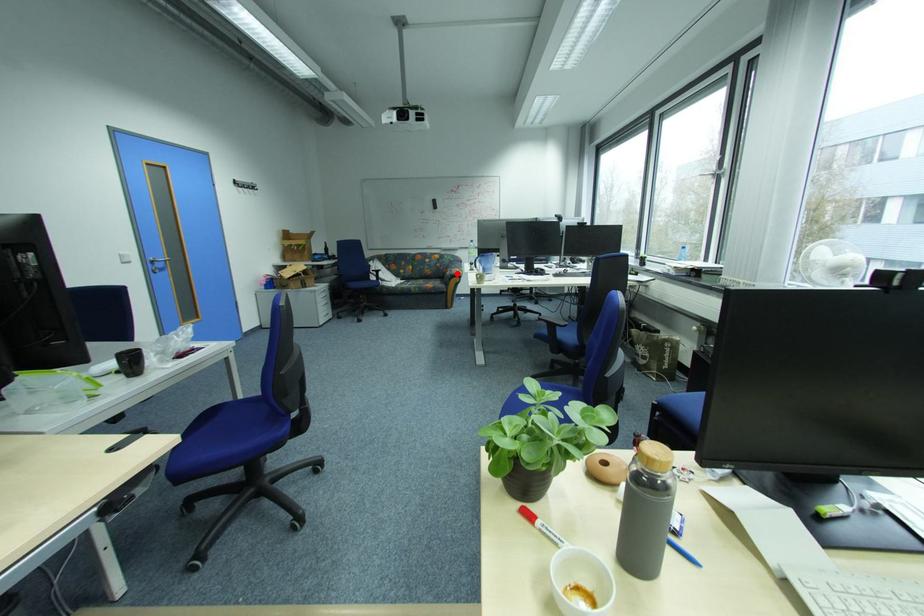
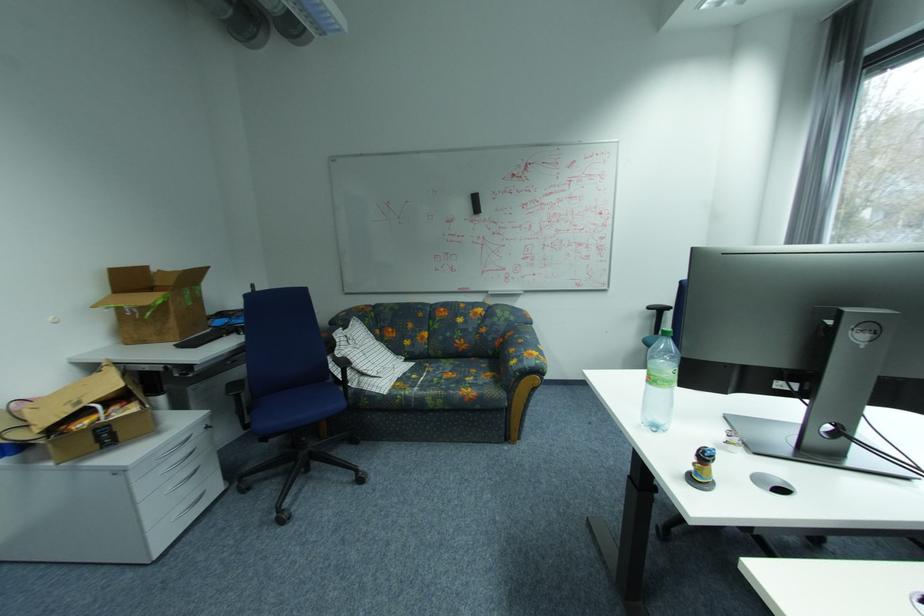
In the second image, find the point that corresponds to the highlighted location in the first image.

(521, 363)